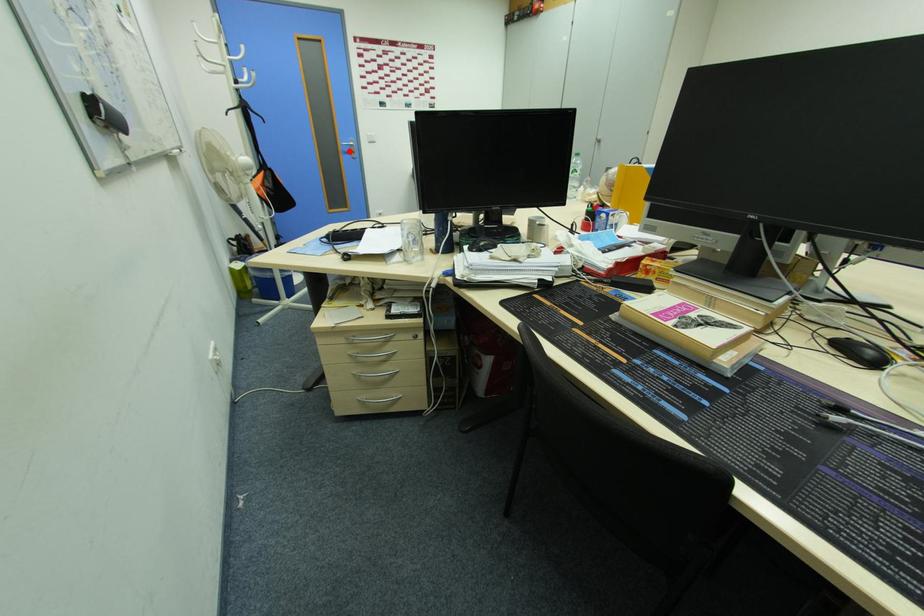
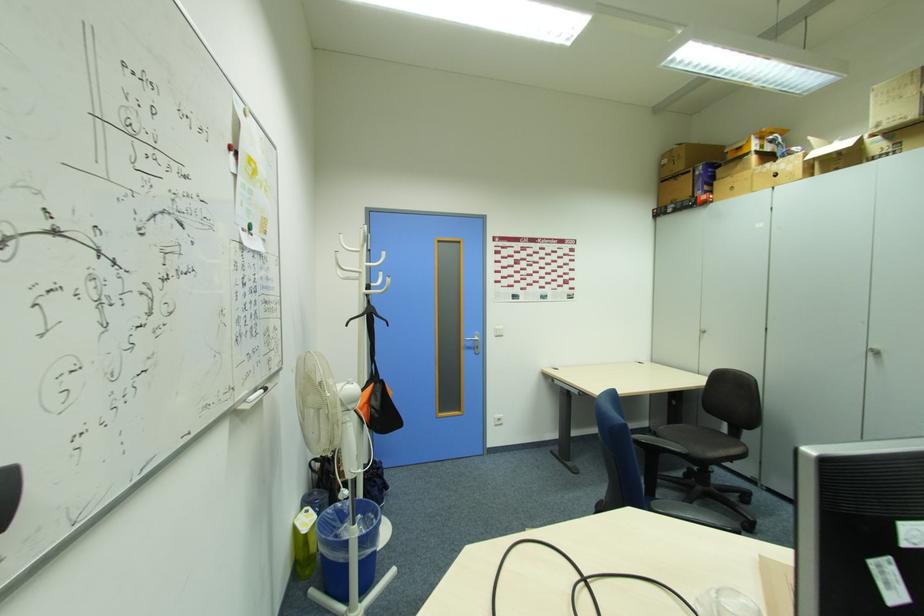
Question: I am providing you with two images of the same scene from different viewpoints. A red point is shown in image1. For the corresponding object point in image2, is it positioned nearer or farther from the camera?

Choices:
 (A) Nearer
 (B) Farther

Answer: (B)